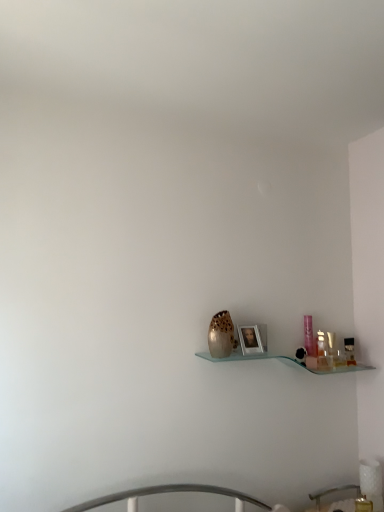
Question: Does translucent glass vase at center have a lesser height compared to translucent plastic bottle at right, the first toiletry from the left?

Choices:
 (A) no
 (B) yes

Answer: (A)

Question: Is translucent glass vase at center wider than translucent plastic bottle at right, the 2th toiletry positioned from the right?

Choices:
 (A) no
 (B) yes

Answer: (B)

Question: Is translucent glass vase at center looking in the opposite direction of translucent plastic bottle at right, the first toiletry from the left?

Choices:
 (A) yes
 (B) no

Answer: (B)

Question: From a real-world perspective, is translucent glass vase at center positioned under translucent plastic bottle at right, the first toiletry from the left, based on gravity?

Choices:
 (A) no
 (B) yes

Answer: (A)

Question: Can we say translucent glass vase at center lies outside translucent plastic bottle at right, the first toiletry from the left?

Choices:
 (A) yes
 (B) no

Answer: (A)

Question: From a real-world perspective, relative to metallic silver frame at center, is translucent plastic bottle at right, the 2th toiletry positioned from the right, vertically above or below?

Choices:
 (A) below
 (B) above

Answer: (A)

Question: Is translucent plastic bottle at right, the first toiletry from the left, bigger or smaller than metallic silver frame at center?

Choices:
 (A) small
 (B) big

Answer: (A)

Question: Choose the correct answer: Is translucent plastic bottle at right, the 2th toiletry positioned from the right, inside metallic silver frame at center or outside it?

Choices:
 (A) outside
 (B) inside

Answer: (A)

Question: Is point (321, 352) closer or farther from the camera than point (248, 335)?

Choices:
 (A) closer
 (B) farther

Answer: (B)

Question: Considering the relative positions of metallic silver frame at center and black plastic toiletry at right, the 2th toiletry when ordered from left to right, in the image provided, is metallic silver frame at center to the left or to the right of black plastic toiletry at right, the 2th toiletry when ordered from left to right,?

Choices:
 (A) right
 (B) left

Answer: (B)

Question: From a real-world perspective, is metallic silver frame at center positioned above or below black plastic toiletry at right, the 2th toiletry when ordered from left to right?

Choices:
 (A) below
 (B) above

Answer: (B)

Question: Considering the positions of metallic silver frame at center and black plastic toiletry at right, the 2th toiletry when ordered from left to right, in the image, is metallic silver frame at center taller or shorter than black plastic toiletry at right, the 2th toiletry when ordered from left to right,?

Choices:
 (A) tall
 (B) short

Answer: (A)

Question: Do you think metallic silver frame at center is within black plastic toiletry at right, the 2th toiletry when ordered from left to right, or outside of it?

Choices:
 (A) inside
 (B) outside

Answer: (B)

Question: Relative to translucent glass vase at center, is translucent plastic bottle at right, the first toiletry from the left, in front or behind?

Choices:
 (A) front
 (B) behind

Answer: (B)

Question: From their relative heights in the image, would you say translucent plastic bottle at right, the 2th toiletry positioned from the right, is taller or shorter than translucent glass vase at center?

Choices:
 (A) tall
 (B) short

Answer: (B)